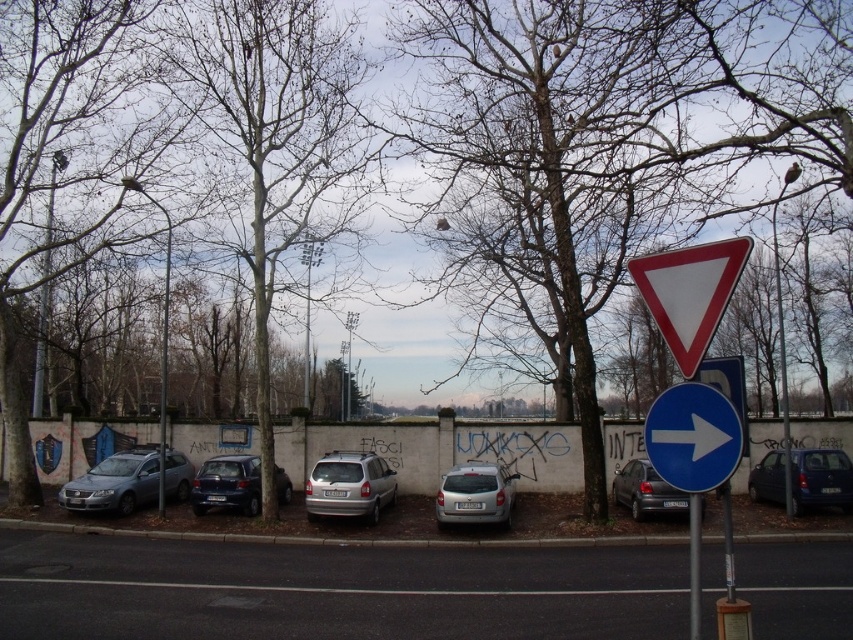
You are a driver approaching the intersection and see the blue glossy arrow at right and the metallic blue hatchback at right. Which object is smaller in size?

The blue glossy arrow at right is smaller in size compared to the metallic blue hatchback at right.

In the scene shown: You are a pedestrian crossing the street and see the white plastic triangle at upper right and the metallic blue hatchback at right. Which object is closer to you?

The white plastic triangle at upper right is closer to you because it is smaller than the metallic blue hatchback at right, which is further away.